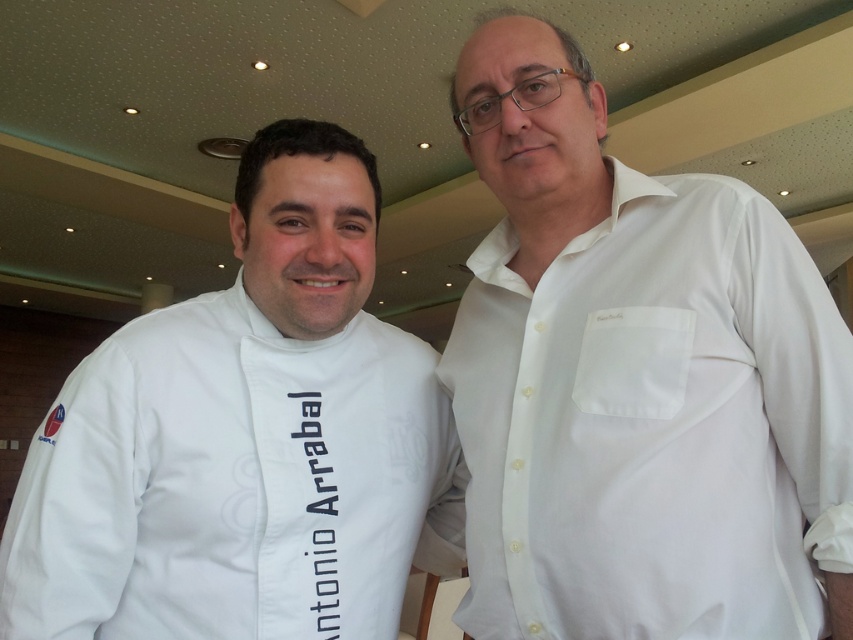
Is point (700, 628) positioned behind point (253, 362)?

That is False.

The width and height of the screenshot is (853, 640). Find the location of `white cotton shirt at right`. white cotton shirt at right is located at coordinates (653, 422).